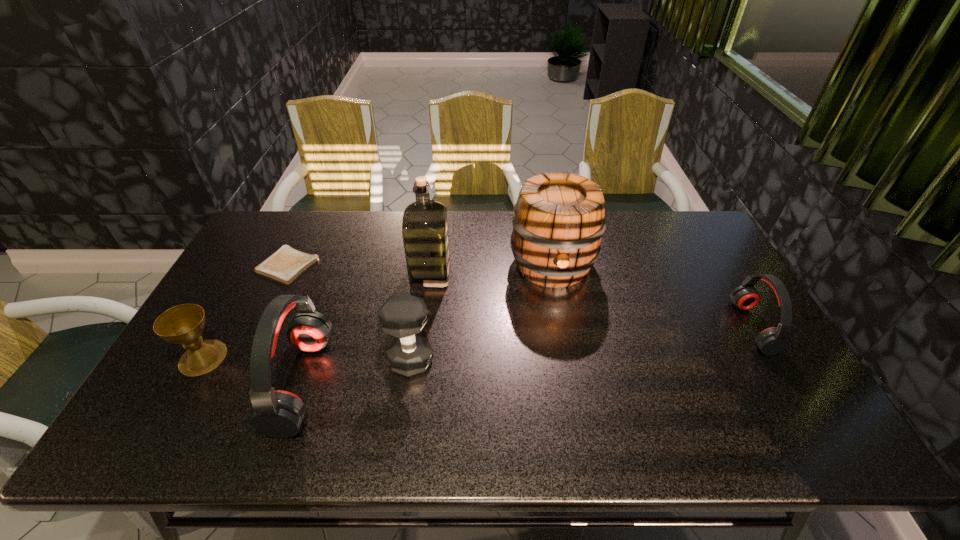
You are a GUI agent. You are given a task and a screenshot of the screen. Output one action in this format:
    pyautogui.click(x=<x>, y=<y>)
    Task: Click on the vacant area between the tallest object and the cider
    The image size is (960, 540).
    Given the screenshot: What is the action you would take?
    pyautogui.click(x=492, y=269)

This screenshot has width=960, height=540. I want to click on object that can be found as the sixth closest to the liquor, so click(x=771, y=341).

Locate an element on the screen. the fourth closest object relative to the chalice is located at coordinates (425, 226).

You are a GUI agent. You are given a task and a screenshot of the screen. Output one action in this format:
    pyautogui.click(x=<x>, y=<y>)
    Task: Click on the free space that satisfies the following two spatial constraints: 1. on the back side of the toast; 2. on the right side of the chalice
    This screenshot has width=960, height=540.
    Given the screenshot: What is the action you would take?
    pyautogui.click(x=255, y=265)

Where is `free point that satisfies the following two spatial constraints: 1. on the side of the sixth object from left to right where the spigot is located; 2. on the label of the liquor`? The height and width of the screenshot is (540, 960). free point that satisfies the following two spatial constraints: 1. on the side of the sixth object from left to right where the spigot is located; 2. on the label of the liquor is located at coordinates (554, 274).